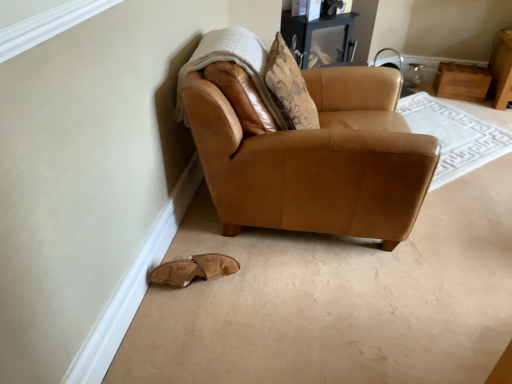
Question: Does saddle brown leather armchair at lower left appear on the left side of white textured blanket at upper left?

Choices:
 (A) yes
 (B) no

Answer: (B)

Question: Considering the relative sizes of saddle brown leather armchair at lower left and white textured blanket at upper left in the image provided, is saddle brown leather armchair at lower left shorter than white textured blanket at upper left?

Choices:
 (A) yes
 (B) no

Answer: (B)

Question: Considering the relative positions of saddle brown leather armchair at lower left and white textured blanket at upper left in the image provided, is saddle brown leather armchair at lower left to the right of white textured blanket at upper left from the viewer's perspective?

Choices:
 (A) yes
 (B) no

Answer: (A)

Question: From the image's perspective, would you say saddle brown leather armchair at lower left is positioned over white textured blanket at upper left?

Choices:
 (A) yes
 (B) no

Answer: (B)

Question: Is saddle brown leather armchair at lower left oriented towards white textured blanket at upper left?

Choices:
 (A) yes
 (B) no

Answer: (B)

Question: Is tan suede slipper at lower left to the left or to the right of white textured blanket at upper left in the image?

Choices:
 (A) right
 (B) left

Answer: (B)

Question: Looking at the image, does tan suede slipper at lower left seem bigger or smaller compared to white textured blanket at upper left?

Choices:
 (A) small
 (B) big

Answer: (A)

Question: From their relative heights in the image, would you say tan suede slipper at lower left is taller or shorter than white textured blanket at upper left?

Choices:
 (A) tall
 (B) short

Answer: (B)

Question: From a real-world perspective, is tan suede slipper at lower left physically located above or below white textured blanket at upper left?

Choices:
 (A) below
 (B) above

Answer: (A)

Question: In terms of height, does tan suede slipper at lower left look taller or shorter compared to matte black entertainment center at upper center?

Choices:
 (A) short
 (B) tall

Answer: (A)

Question: Considering the positions of tan suede slipper at lower left and matte black entertainment center at upper center in the image, is tan suede slipper at lower left bigger or smaller than matte black entertainment center at upper center?

Choices:
 (A) small
 (B) big

Answer: (A)

Question: From the image's perspective, is tan suede slipper at lower left positioned above or below matte black entertainment center at upper center?

Choices:
 (A) below
 (B) above

Answer: (A)

Question: Based on their positions, is tan suede slipper at lower left located to the left or right of matte black entertainment center at upper center?

Choices:
 (A) left
 (B) right

Answer: (A)

Question: From a real-world perspective, relative to saddle brown leather armchair at lower left, is matte black entertainment center at upper center vertically above or below?

Choices:
 (A) above
 (B) below

Answer: (A)

Question: Considering the positions of matte black entertainment center at upper center and saddle brown leather armchair at lower left in the image, is matte black entertainment center at upper center taller or shorter than saddle brown leather armchair at lower left?

Choices:
 (A) short
 (B) tall

Answer: (A)